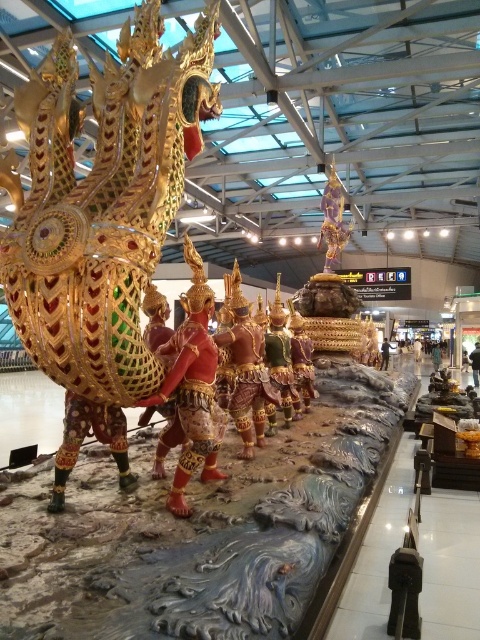
You are an art curator planning to move the gold metallic dragon at center and the smooth gold statue at center to a new exhibition space. If you need to place them in the same relative positions as in the original image, which object should be placed closer to the entrance so that it appears in front of the other?

The gold metallic dragon at center should be placed closer to the entrance because it is in front of the smooth gold statue at center in the original image.

You are an art curator planning to display both the gold metallic dragon at center and the smooth gold statue at center in a new exhibition. Based on their sizes, which one should be placed in a larger display area to accommodate its size?

The gold metallic dragon at center is bigger than the smooth gold statue at center, so it should be placed in a larger display area to accommodate its size.

Where is the gold metallic dragon at center located in the image?

The gold metallic dragon at center is located at point (103,220).